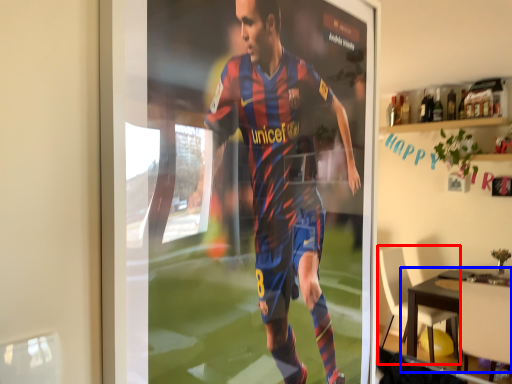
Question: Which point is closer to the camera, chair (highlighted by a red box) or table (highlighted by a blue box)?

Choices:
 (A) chair
 (B) table

Answer: (B)